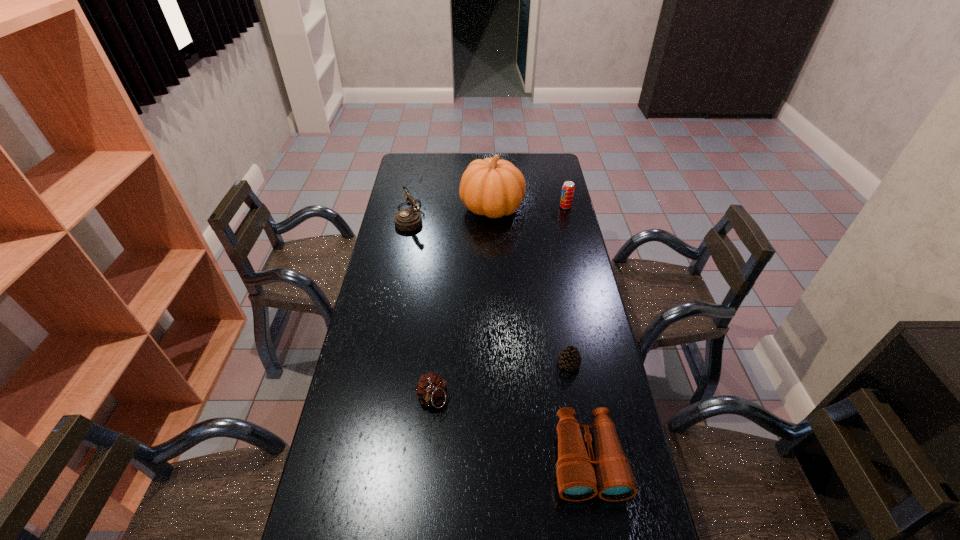
Find the location of a particular element. The image size is (960, 540). the tallest object is located at coordinates (491, 187).

You are a GUI agent. You are given a task and a screenshot of the screen. Output one action in this format:
    pyautogui.click(x=<x>, y=<y>)
    Task: Click on the leftmost object
    This screenshot has height=540, width=960.
    Given the screenshot: What is the action you would take?
    pyautogui.click(x=409, y=219)

Where is `soda can`? The height and width of the screenshot is (540, 960). soda can is located at coordinates (568, 187).

The height and width of the screenshot is (540, 960). I want to click on the nearer pinecone, so pyautogui.click(x=431, y=389).

Find the location of a particular element. the taller pinecone is located at coordinates (431, 389).

You are a GUI agent. You are given a task and a screenshot of the screen. Output one action in this format:
    pyautogui.click(x=<x>, y=<y>)
    Task: Click on the nearest object
    This screenshot has width=960, height=540.
    Given the screenshot: What is the action you would take?
    pyautogui.click(x=610, y=475)

This screenshot has width=960, height=540. Identify the location of the shortest object. point(569,358).

Image resolution: width=960 pixels, height=540 pixels. Find the location of `the shorter pinecone`. the shorter pinecone is located at coordinates (569, 358).

This screenshot has width=960, height=540. I want to click on blank area located 0.190m on the right of the tallest object, so click(x=565, y=209).

Identify the location of free space located on the front of the telephone. (404, 249).